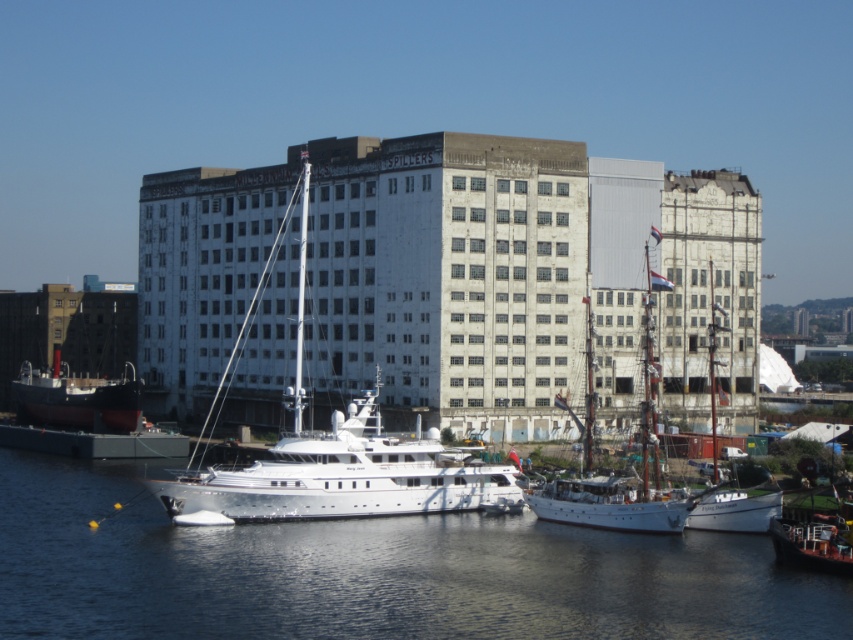
You are a harbor inspector tasked with ensuring all vessels are anchored safely. You notice the red matte ship at lower left. Based on its position at coordinates 0.623, 0.090, can you determine if it is positioned within the designated anchoring zone that spans from 0.5 to 0.7 on the x and y axes?

The red matte ship at lower left is located at point (76, 397). Since the y coordinate 0.090 is below the anchoring zone which starts at 0.5 on the y axis, it is outside the designated anchoring zone.